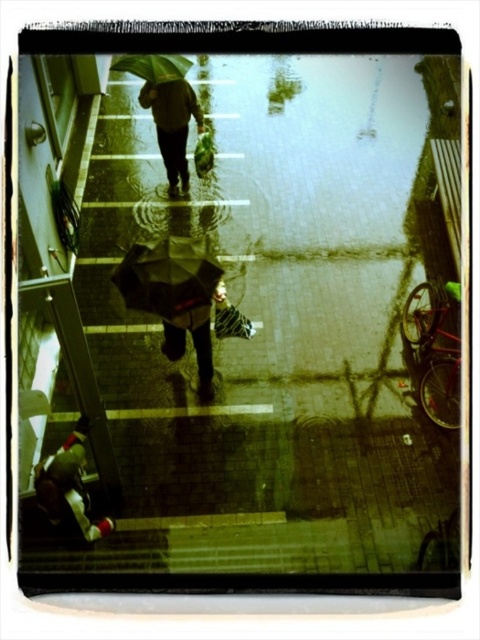
You are standing on a balcony overlooking the rainy scene. You notice a red fabric bag at lower left and a green matte umbrella at upper center. Which object is bigger?

The red fabric bag at lower left is larger in size than the green matte umbrella at upper center, so the red fabric bag at lower left is bigger.